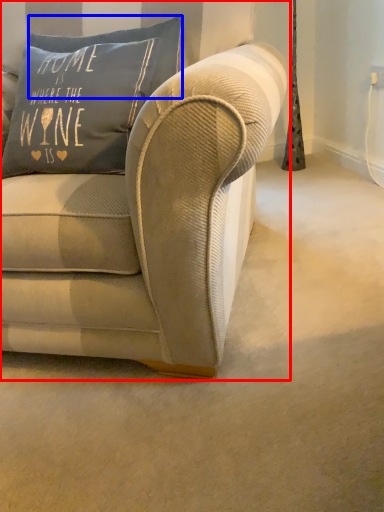
Question: Which point is further to the camera, studio couch (highlighted by a red box) or pillow (highlighted by a blue box)?

Choices:
 (A) studio couch
 (B) pillow

Answer: (B)